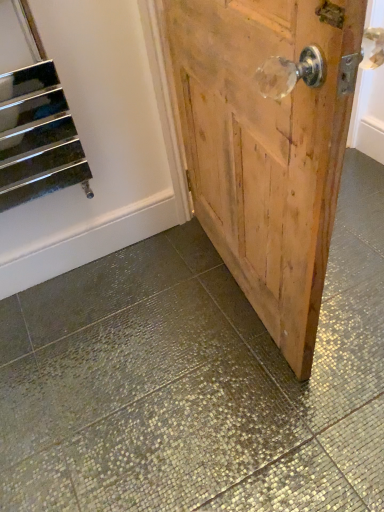
At what (x,y) coordinates should I click in order to perform the action: click on natural wood door at center. Please return your answer as a coordinate pair (x, y). Looking at the image, I should click on (266, 148).

What do you see at coordinates (266, 148) in the screenshot?
I see `natural wood door at center` at bounding box center [266, 148].

I want to click on natural wood door at center, so click(266, 148).